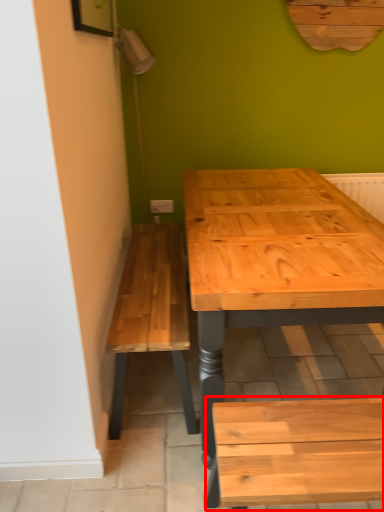
Question: From the image's perspective, what is the correct spatial relationship of church bench (annotated by the red box) in relation to electric outlet?

Choices:
 (A) above
 (B) below

Answer: (B)